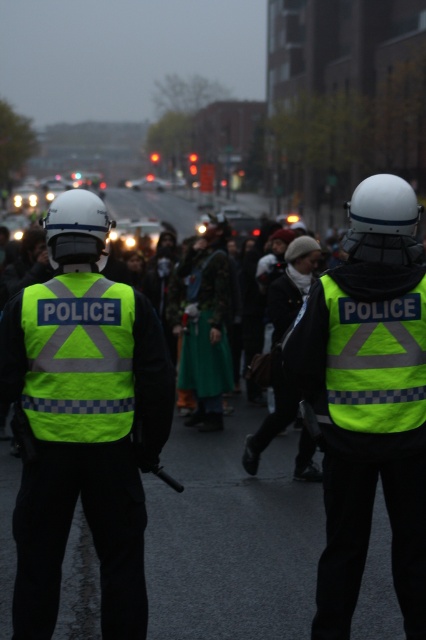
Which of these two, neon yellow reflective vest at center or high-visibility reflective vest at center, stands taller?

high-visibility reflective vest at center is taller.

Who is shorter, neon yellow reflective vest at center or high-visibility reflective vest at center?

neon yellow reflective vest at center

The width and height of the screenshot is (426, 640). Identify the location of neon yellow reflective vest at center. (83, 420).